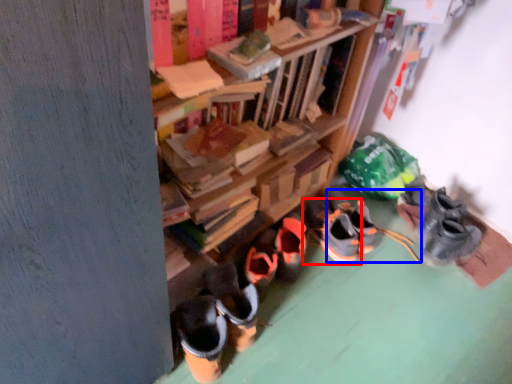
Question: Which object appears farthest to the camera in this image, footwear (highlighted by a red box) or footwear (highlighted by a blue box)?

Choices:
 (A) footwear
 (B) footwear

Answer: (B)